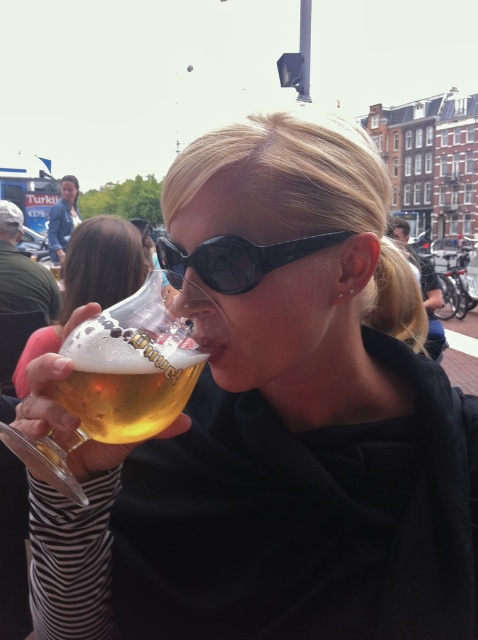
You are a photographer at the event and want to capture the golden glass beer at center and the black plastic sunglasses at center in a single shot. Which object should you focus on first to ensure both are in frame?

The golden glass beer at center is positioned under black plastic sunglasses at center, so focusing on the black plastic sunglasses at center first will ensure the golden glass beer at center is also captured in the frame.

You are standing in the middle of the scene and want to take a photo of both point (136, 260) and point (174, 284). Which point should you focus on first to ensure both are in focus?

You should focus on point (136, 260) first because it is closer to the camera than point (174, 284), ensuring both will be in focus when using depth of field.

You are a photographer at the event and want to capture both the golden glass beer at center and the translucent glass beer at lower left in a single shot. Which beer glass will appear larger in the photo?

The golden glass beer at center will appear larger in the photo because it is closer to the viewer than the translucent glass beer at lower left.